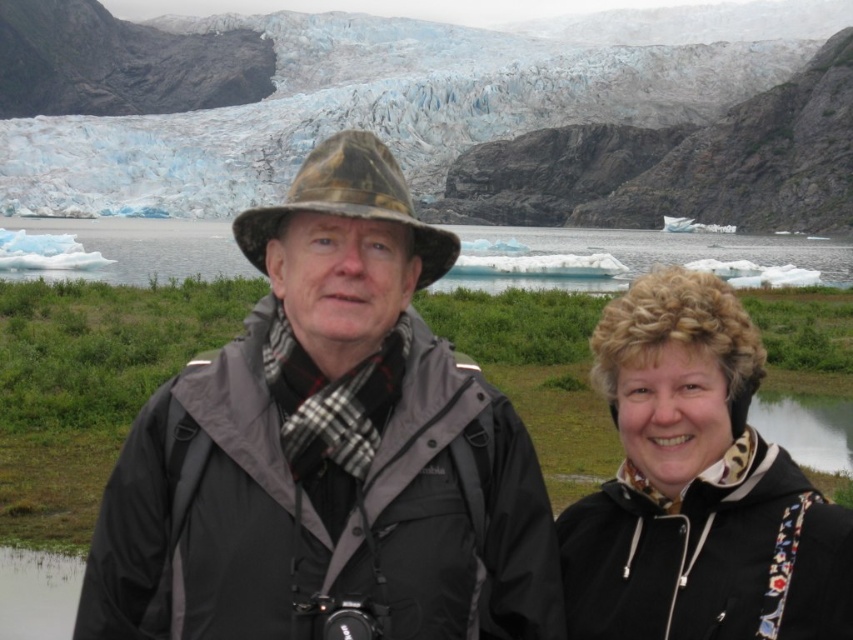
Does rocky cliff at upper center have a smaller size compared to matte gray jacket at center?

Actually, rocky cliff at upper center might be larger than matte gray jacket at center.

The image size is (853, 640). What do you see at coordinates (454, 115) in the screenshot?
I see `rocky cliff at upper center` at bounding box center [454, 115].

Identify the location of rocky cliff at upper center. (454, 115).

Is matte gray jacket at center to the right of transparent blue water at center from the viewer's perspective?

Incorrect, matte gray jacket at center is not on the right side of transparent blue water at center.

Is the position of matte gray jacket at center more distant than that of transparent blue water at center?

No, it is not.

Describe the element at coordinates (325, 449) in the screenshot. The width and height of the screenshot is (853, 640). I see `matte gray jacket at center` at that location.

At what (x,y) coordinates should I click in order to perform the action: click on matte gray jacket at center. Please return your answer as a coordinate pair (x, y). Looking at the image, I should click on (325, 449).

In the scene shown: Between matte gray jacket at center and camouflage fabric hat at center, which one is positioned higher?

Positioned higher is camouflage fabric hat at center.

Who is positioned more to the left, matte gray jacket at center or camouflage fabric hat at center?

From the viewer's perspective, camouflage fabric hat at center appears more on the left side.

Is point (349, 392) behind point (367, 173)?

Yes, point (349, 392) is behind point (367, 173).

Locate an element on the screen. This screenshot has height=640, width=853. matte gray jacket at center is located at coordinates (325, 449).